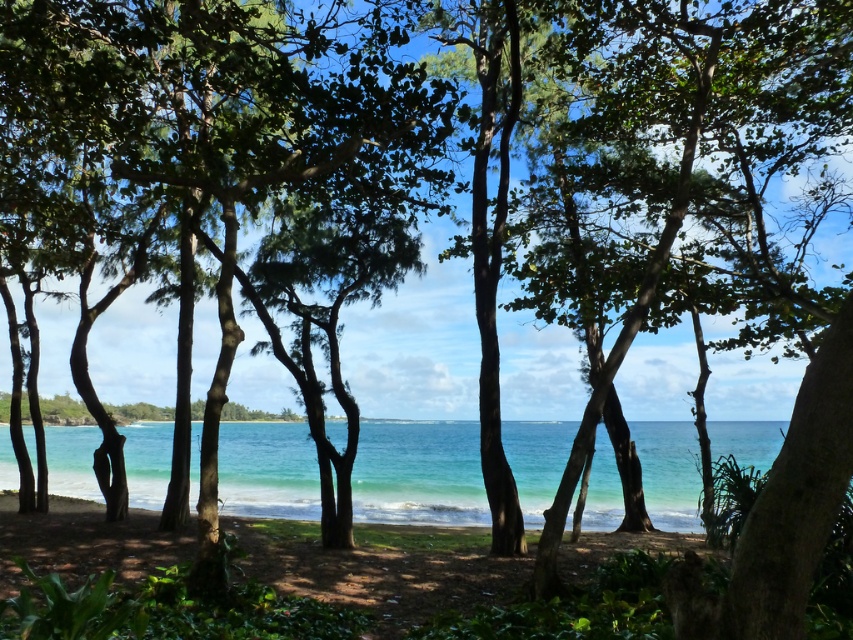
You are standing at the edge of the coastal area and see both the clear blue water at center and the green sand at center. Which one is closer to you?

The clear blue water at center is closer to you since it is in front of the green sand at center.